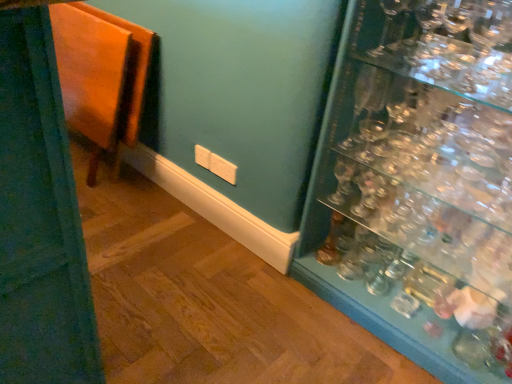
Question: From the image's perspective, is clear glass wine glass at upper right located beneath wooden folding table at left?

Choices:
 (A) yes
 (B) no

Answer: (B)

Question: Is the position of clear glass wine glass at upper right more distant than that of wooden folding table at left?

Choices:
 (A) yes
 (B) no

Answer: (B)

Question: Does clear glass wine glass at upper right have a greater height compared to wooden folding table at left?

Choices:
 (A) yes
 (B) no

Answer: (B)

Question: Considering the relative sizes of clear glass wine glass at upper right and wooden folding table at left in the image provided, is clear glass wine glass at upper right bigger than wooden folding table at left?

Choices:
 (A) no
 (B) yes

Answer: (A)

Question: Would you say clear glass wine glass at upper right is outside wooden folding table at left?

Choices:
 (A) no
 (B) yes

Answer: (B)

Question: From a real-world perspective, is clear glass wine glass at upper right located higher than wooden folding table at left?

Choices:
 (A) no
 (B) yes

Answer: (B)

Question: From the image's perspective, is wooden folding table at left above transparent glass shelves at right?

Choices:
 (A) no
 (B) yes

Answer: (B)

Question: From the image's perspective, does wooden folding table at left appear lower than transparent glass shelves at right?

Choices:
 (A) yes
 (B) no

Answer: (B)

Question: Does wooden folding table at left contain transparent glass shelves at right?

Choices:
 (A) yes
 (B) no

Answer: (B)

Question: Is wooden folding table at left facing away from transparent glass shelves at right?

Choices:
 (A) no
 (B) yes

Answer: (A)

Question: Can you confirm if wooden folding table at left is thinner than transparent glass shelves at right?

Choices:
 (A) no
 (B) yes

Answer: (B)

Question: Is wooden folding table at left taller than transparent glass shelves at right?

Choices:
 (A) yes
 (B) no

Answer: (B)

Question: From a real-world perspective, does transparent glass shelves at right stand above clear glass wine glass at upper right?

Choices:
 (A) yes
 (B) no

Answer: (B)